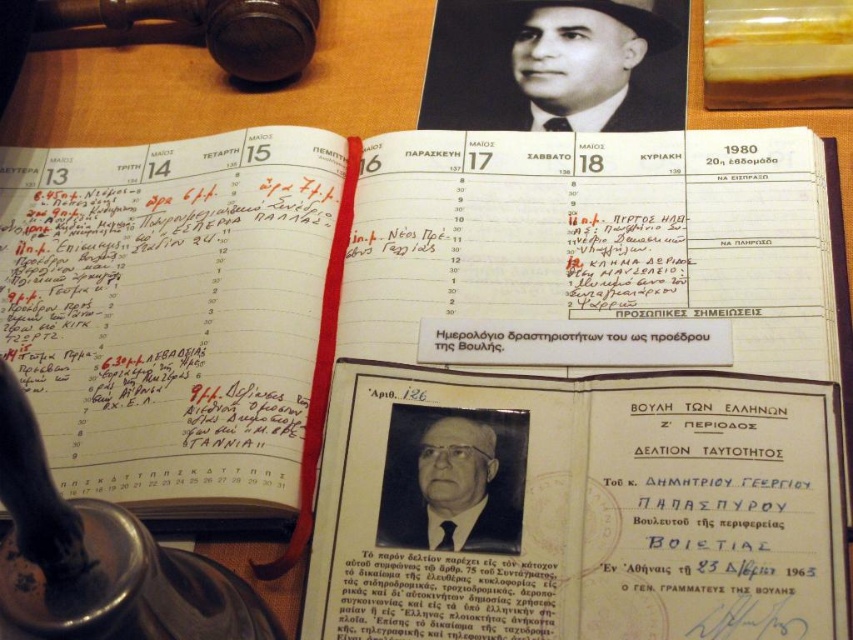
You are organizing a museum exhibit and need to place the white paper document at center and the black glossy photo of man at center side by side. Which object should be placed first to ensure the total width fits within a 1.2 meter display case?

The white paper document at center is wider than the black glossy photo of man at center. To fit both within the 1.2 meter display case, place the wider white paper document at center first, then the narrower black glossy photo of man at center, ensuring their combined width does not exceed the case.

You are a photographer taking a closeup shot of the calendar. You need to adjust your focus so that both the point at (775, 381) and the point at (583, 83) are in focus. Which point should you focus on first to ensure both are sharp?

You should focus on point (583, 83) first because it is farther from the camera than point (775, 381), allowing the depth of field to cover both points.

You are an archivist organizing documents on a wooden table. You have a white paper document at center and need to place it next to the calendar for May 1980. According to the layout, where should you position it relative to the calendar?

The white paper document at center is located at point (576,508), so you should position it to the right of the calendar for May 1980 since the coordinates indicate it is in that direction.